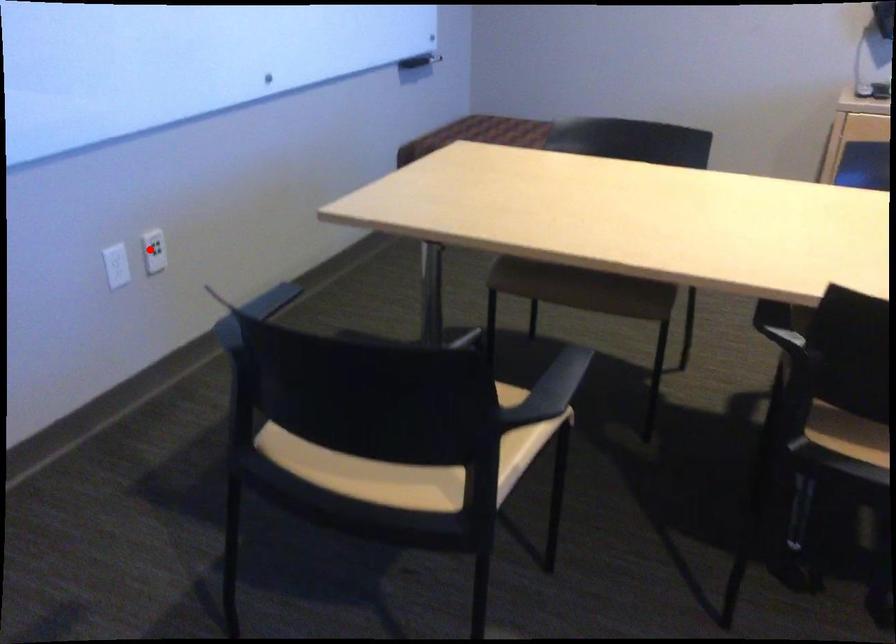
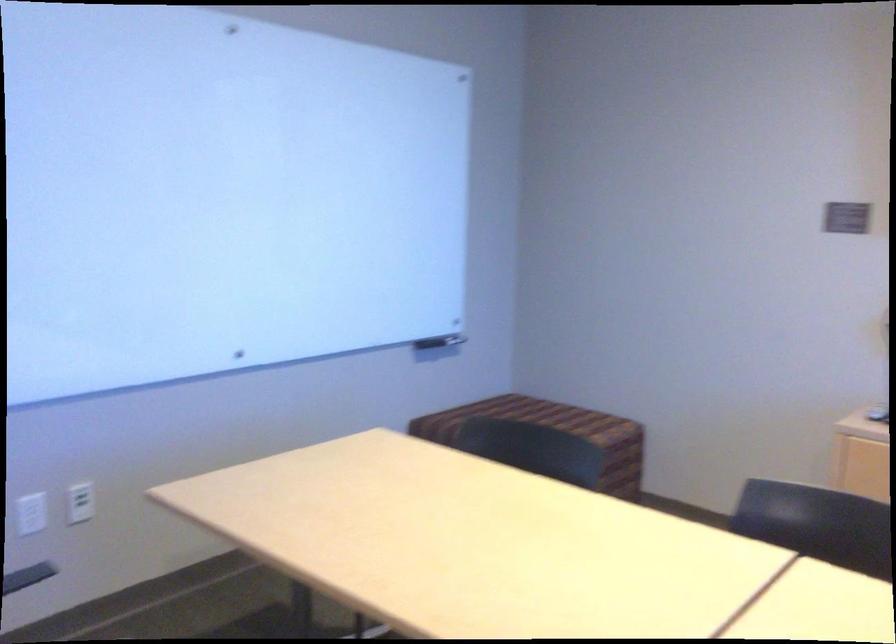
Find the pixel in the second image that matches the highlighted location in the first image.

(80, 502)